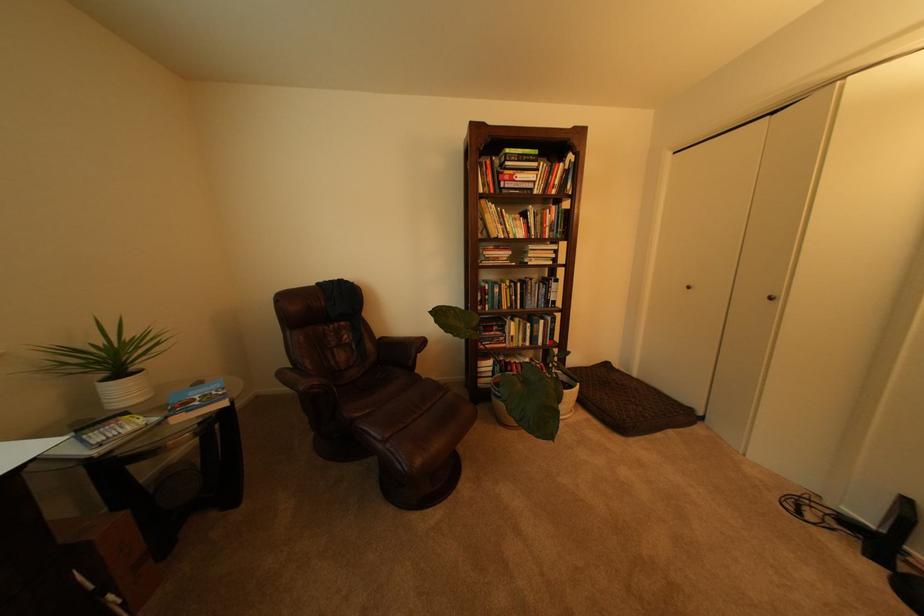
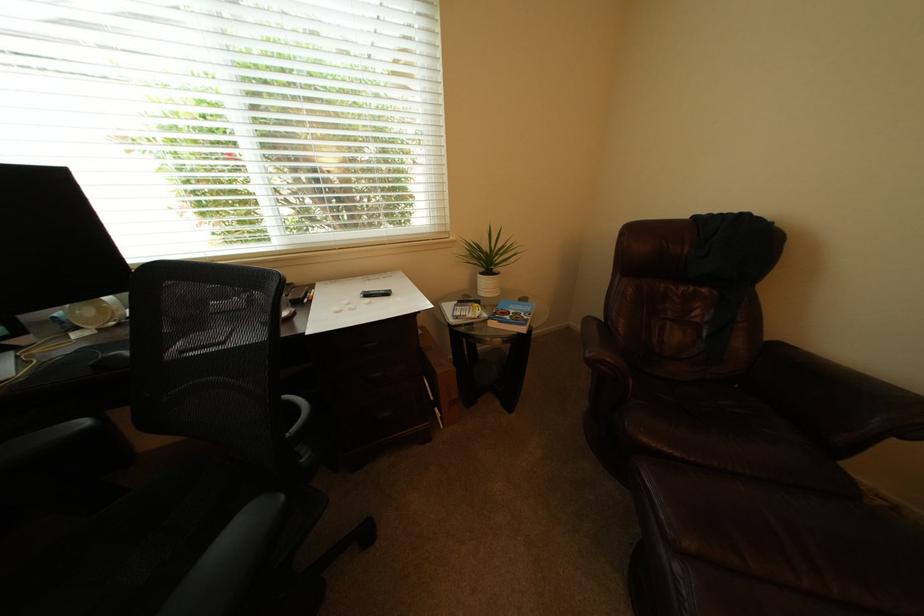
Where in the second image is the point corresponding to point 269,399 from the first image?

(579, 331)